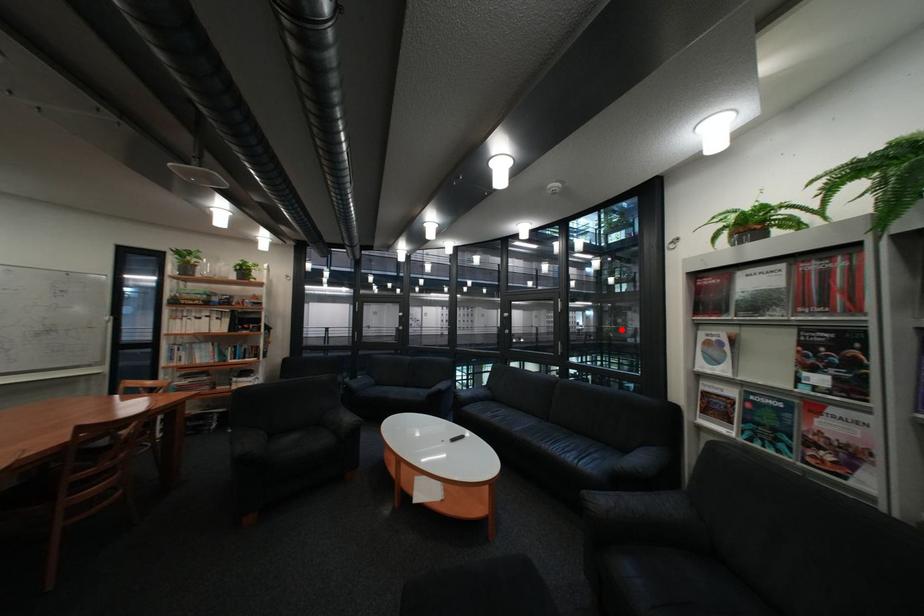
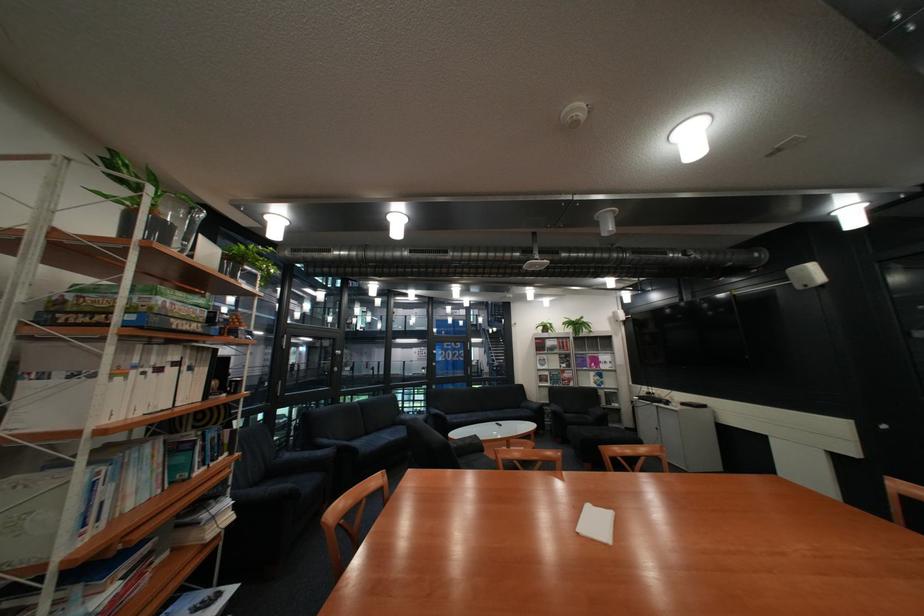
Question: I am providing you with two images of the same scene from different viewpoints. A red point is shown in image1. For the corresponding object point in image2, is it positioned nearer or farther from the camera?

Choices:
 (A) Nearer
 (B) Farther

Answer: (B)